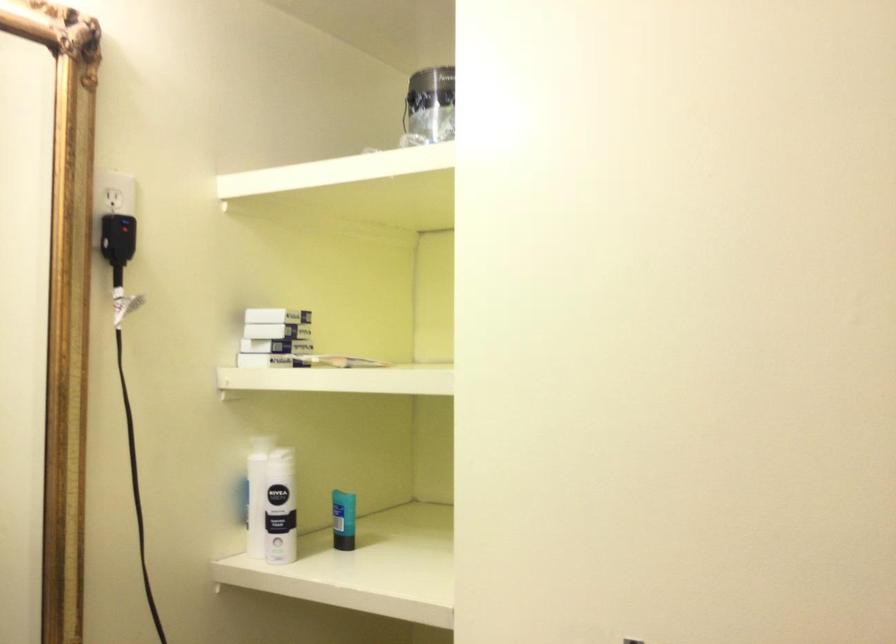
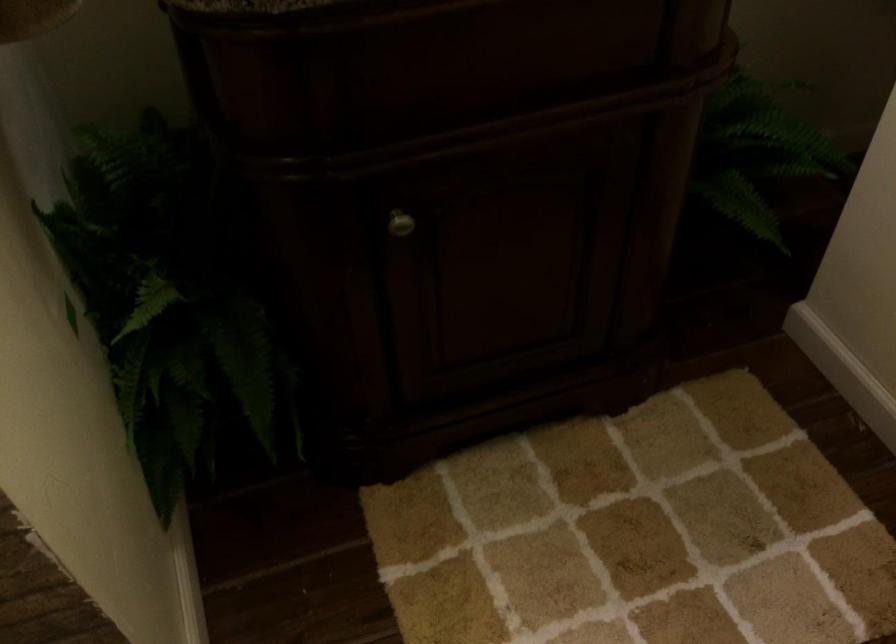
How did the camera likely rotate?

The camera's rotation is toward left-down.